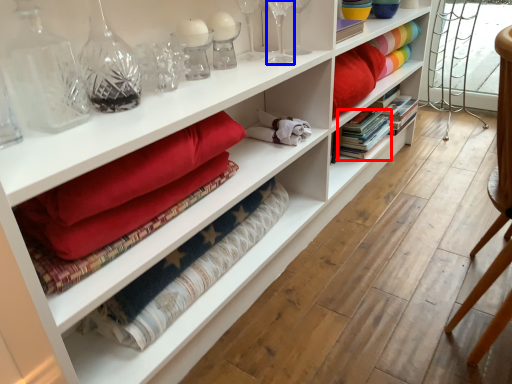
Question: Which point is closer to the camera, book (highlighted by a red box) or glass vase (highlighted by a blue box)?

Choices:
 (A) book
 (B) glass vase

Answer: (B)